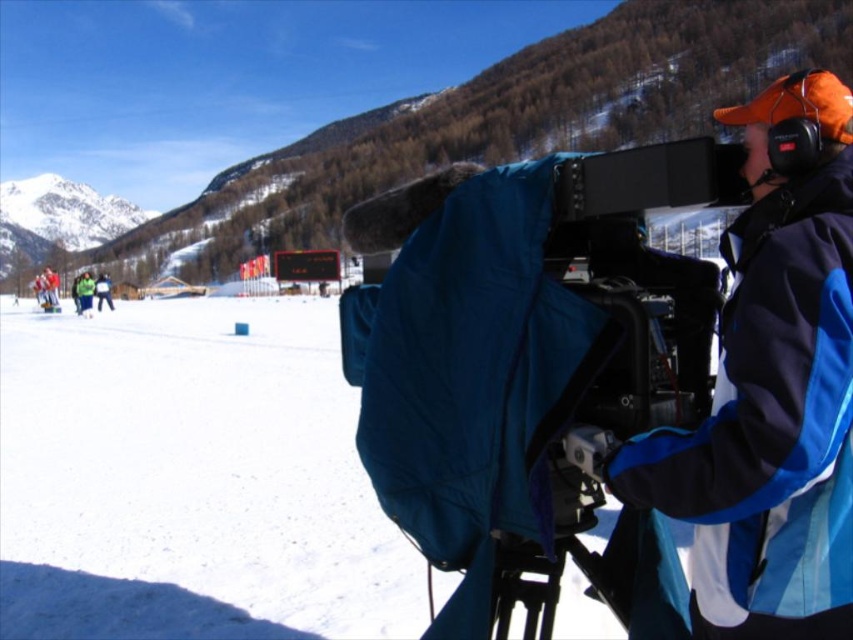
You are a photographer standing at the center of the scene. You want to capture both the green reflective jacket at lower left and the green fabric jacket at lower left in a single photo. What is the minimum distance you need to move backward to ensure both jackets are fully visible in your shot?

The green reflective jacket at lower left and green fabric jacket at lower left are 3.21 meters apart. To capture both in a single photo, you need to move backward until the distance between them fits within your camera frame. The exact distance depends on your camera lens, but generally, moving back several meters should work.